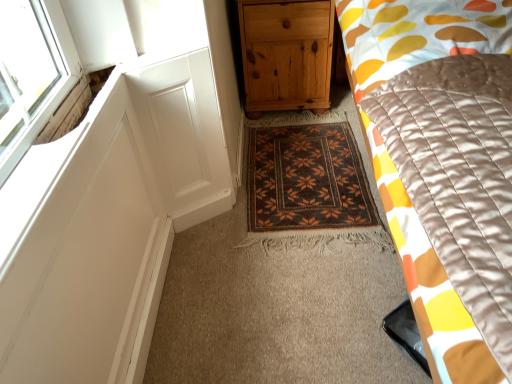
Identify the location of vacant area that is in front of brown woven mat at center. The width and height of the screenshot is (512, 384). (261, 307).